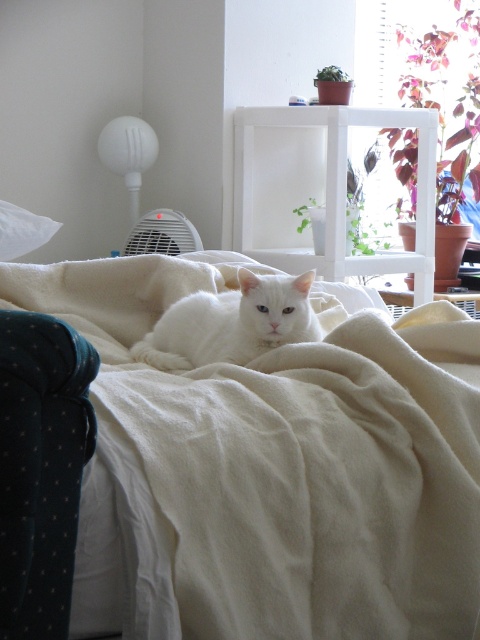
Who is lower down, white soft blanket at center or white fluffy cat at center?

white soft blanket at center

Between white soft blanket at center and white fluffy cat at center, which one is positioned higher?

white fluffy cat at center is higher up.

Is point (474, 524) farther from viewer compared to point (206, 314)?

No, it is in front of (206, 314).

Locate an element on the screen. The width and height of the screenshot is (480, 640). white soft blanket at center is located at coordinates (268, 472).